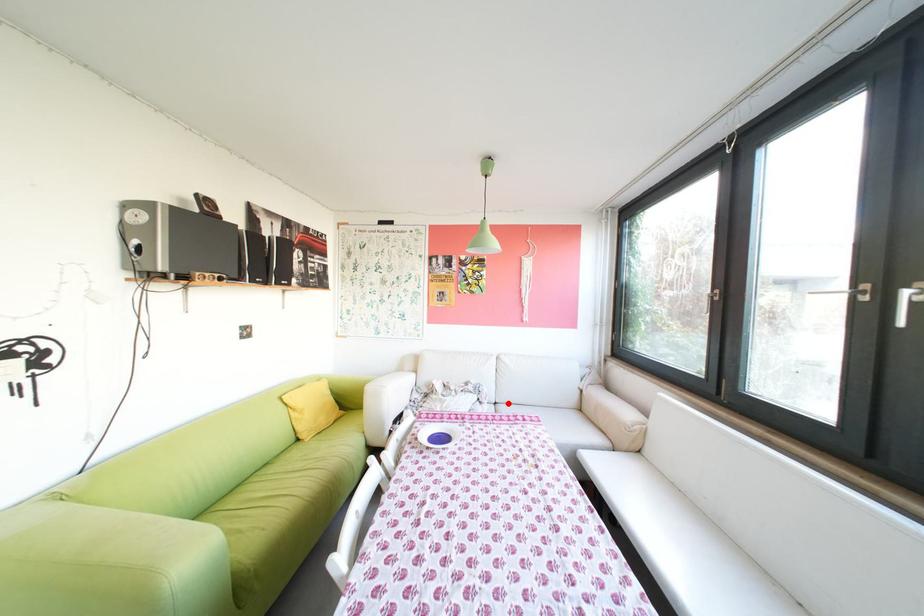
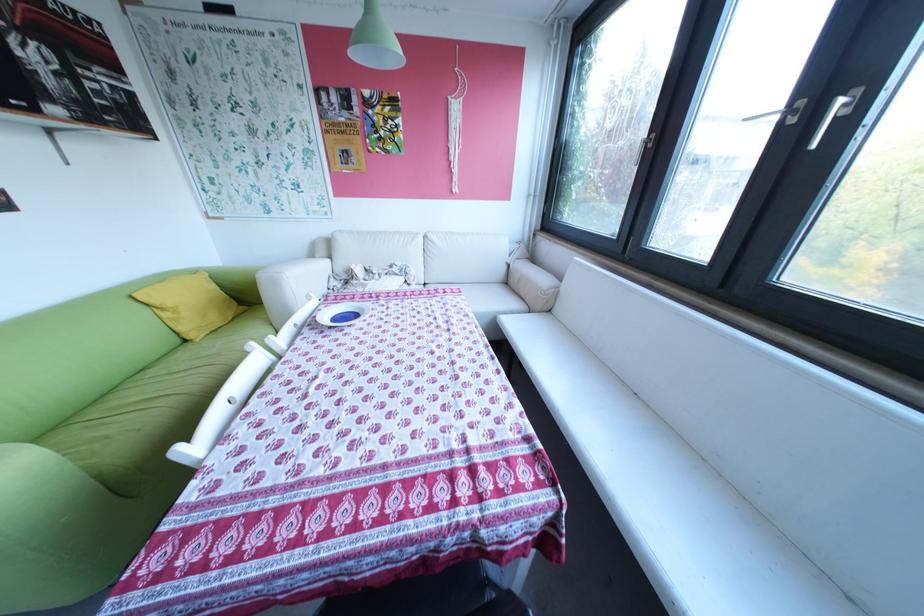
Question: I am providing you with two images of the same scene from different viewpoints. Image1 has a red point marked. In image2, the corresponding 3D location appears at what relative position? Reply with the corresponding letter.

Choices:
 (A) Closer
 (B) Farther

Answer: (B)